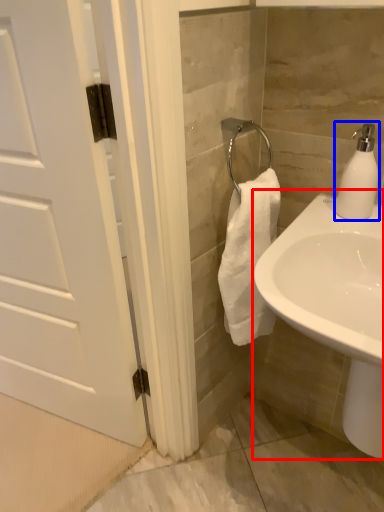
Question: Among these objects, which one is farthest to the camera, sink (highlighted by a red box) or soap dispenser (highlighted by a blue box)?

Choices:
 (A) sink
 (B) soap dispenser

Answer: (B)